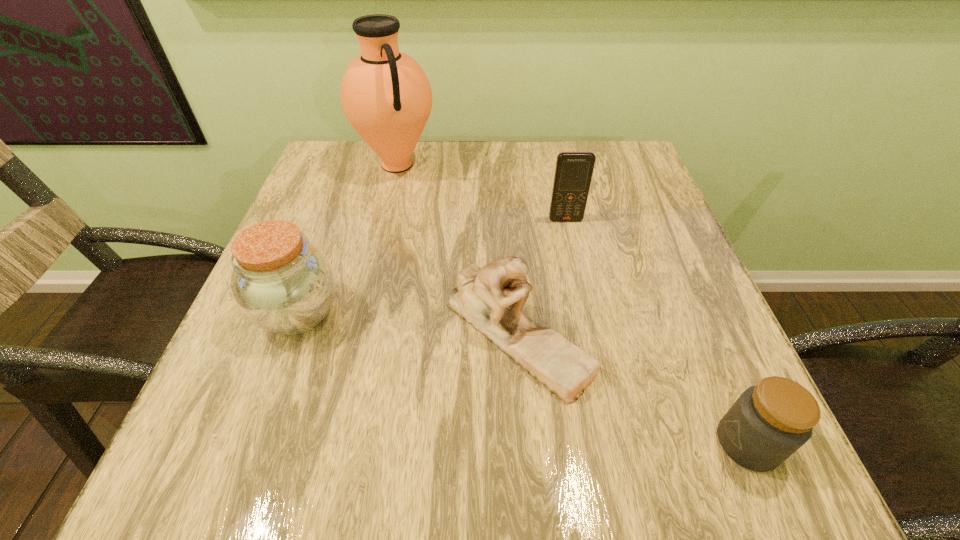
Locate an element on the screen. The width and height of the screenshot is (960, 540). object that is at the near right corner is located at coordinates (770, 421).

Locate an element on the screen. Image resolution: width=960 pixels, height=540 pixels. vacant space at the far edge of the desktop is located at coordinates (535, 191).

Identify the location of free location at the near edge of the desktop. This screenshot has width=960, height=540. (551, 472).

Locate an element on the screen. This screenshot has width=960, height=540. blank space at the left edge of the desktop is located at coordinates (325, 232).

Where is `vacant region at the right edge of the desktop`? vacant region at the right edge of the desktop is located at coordinates click(660, 292).

In the image, there is a desktop. Find the location of `vacant space at the far left corner`. vacant space at the far left corner is located at coordinates (354, 177).

Image resolution: width=960 pixels, height=540 pixels. I want to click on vacant space at the far right corner of the desktop, so click(x=594, y=153).

Identify the location of vacant space at the near right corner of the desktop. The height and width of the screenshot is (540, 960). (702, 447).

Identify the location of vacant area that lies between the shorter jar and the figurine. This screenshot has width=960, height=540. (633, 388).

Where is `unoccupied area between the figurine and the taller jar`? The image size is (960, 540). unoccupied area between the figurine and the taller jar is located at coordinates (408, 323).